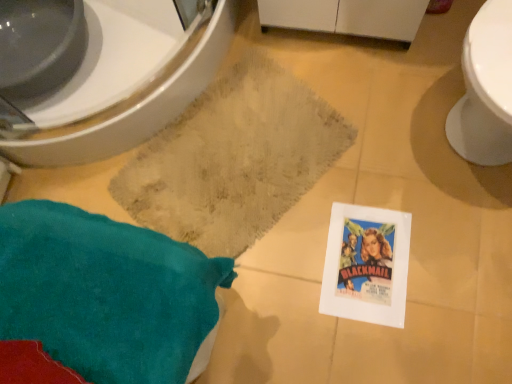
What do you see at coordinates (101, 299) in the screenshot? The height and width of the screenshot is (384, 512). I see `teal fabric throw pillow at lower left` at bounding box center [101, 299].

Locate an element on the screen. teal fabric throw pillow at lower left is located at coordinates (101, 299).

The width and height of the screenshot is (512, 384). I want to click on teal fabric throw pillow at lower left, so click(101, 299).

Can we say teal fabric throw pillow at lower left lies outside beige textured bath mat at center?

Yes, teal fabric throw pillow at lower left is not within beige textured bath mat at center.

Is teal fabric throw pillow at lower left at the right side of beige textured bath mat at center?

In fact, teal fabric throw pillow at lower left is to the left of beige textured bath mat at center.

Is teal fabric throw pillow at lower left placed right next to beige textured bath mat at center?

No, teal fabric throw pillow at lower left is not touching beige textured bath mat at center.

Consider the image. From the image's perspective, which object appears higher, teal fabric throw pillow at lower left or beige textured bath mat at center?

beige textured bath mat at center appears higher in the image.

Can you confirm if teal fabric throw pillow at lower left is positioned to the right of white glossy bidet at upper left?

Yes.

Does teal fabric throw pillow at lower left have a lesser width compared to white glossy bidet at upper left?

Correct, the width of teal fabric throw pillow at lower left is less than that of white glossy bidet at upper left.

Which object is further away from the camera taking this photo, white glossy bidet at upper left or teal fabric throw pillow at lower left?

white glossy bidet at upper left is further from the camera.

Is white glossy bidet at upper left to the left or to the right of teal fabric throw pillow at lower left in the image?

Clearly, white glossy bidet at upper left is on the left of teal fabric throw pillow at lower left in the image.

How distant is white glossy bidet at upper left from teal fabric throw pillow at lower left?

The distance of white glossy bidet at upper left from teal fabric throw pillow at lower left is 24.06 inches.

From a real-world perspective, is white glossy bidet at upper left on top of teal fabric throw pillow at lower left?

No.

Which is closer to the camera, (268, 173) or (63, 162)?

Point (268, 173) is closer to the camera than point (63, 162).

From a real-world perspective, is beige textured bath mat at center positioned over white glossy bidet at upper left based on gravity?

No, from a real-world perspective, beige textured bath mat at center is not above white glossy bidet at upper left.

Which is in front, beige textured bath mat at center or white glossy bidet at upper left?

white glossy bidet at upper left.

Is beige textured bath mat at center far from white glossy bidet at upper left?

No, beige textured bath mat at center is not far from white glossy bidet at upper left.

Which point is more forward, (61, 155) or (264, 138)?

The point (61, 155) is closer.

Is beige textured bath mat at center a part of white glossy bidet at upper left?

No, beige textured bath mat at center is located outside of white glossy bidet at upper left.

From a real-world perspective, which object rests below the other?

beige textured bath mat at center, from a real-world perspective.

Between white glossy bidet at upper left and beige textured bath mat at center, which one is positioned in front?

Positioned in front is white glossy bidet at upper left.

Is beige textured bath mat at center situated inside teal fabric throw pillow at lower left or outside?

beige textured bath mat at center is not inside teal fabric throw pillow at lower left, it's outside.

What are the coordinates of `throw pillow on the left of beige textured bath mat at center` in the screenshot? It's located at (101, 299).

Considering the sizes of objects beige textured bath mat at center and teal fabric throw pillow at lower left in the image provided, who is bigger, beige textured bath mat at center or teal fabric throw pillow at lower left?

teal fabric throw pillow at lower left.

Which point is more distant from viewer, (217, 122) or (31, 327)?

The point (217, 122) is behind.

The image size is (512, 384). I want to click on bath mat to the right of teal fabric throw pillow at lower left, so (234, 159).

This screenshot has height=384, width=512. I want to click on bidet that appears above the teal fabric throw pillow at lower left (from the image's perspective), so click(136, 107).

Considering their positions, is teal fabric throw pillow at lower left positioned further to white glossy bidet at upper left than beige textured bath mat at center?

Among the two, teal fabric throw pillow at lower left is located further to white glossy bidet at upper left.

Which object lies further to the anchor point white glossy bidet at upper left, beige textured bath mat at center or teal fabric throw pillow at lower left?

teal fabric throw pillow at lower left.

Which object lies nearer to the anchor point teal fabric throw pillow at lower left, beige textured bath mat at center or white glossy bidet at upper left?

The object closer to teal fabric throw pillow at lower left is beige textured bath mat at center.

Looking at the image, which one is located further to teal fabric throw pillow at lower left, white glossy bidet at upper left or beige textured bath mat at center?

white glossy bidet at upper left is further to teal fabric throw pillow at lower left.

Looking at the image, which one is located further to beige textured bath mat at center, white glossy bidet at upper left or teal fabric throw pillow at lower left?

Among the two, teal fabric throw pillow at lower left is located further to beige textured bath mat at center.

When comparing their distances from beige textured bath mat at center, does teal fabric throw pillow at lower left or white glossy bidet at upper left seem further?

Among the two, teal fabric throw pillow at lower left is located further to beige textured bath mat at center.

You are a GUI agent. You are given a task and a screenshot of the screen. Output one action in this format:
    pyautogui.click(x=<x>, y=<y>)
    Task: Click on the bidet between teal fabric throw pillow at lower left and beige textured bath mat at center along the z-axis
    The image size is (512, 384).
    Given the screenshot: What is the action you would take?
    pyautogui.click(x=136, y=107)